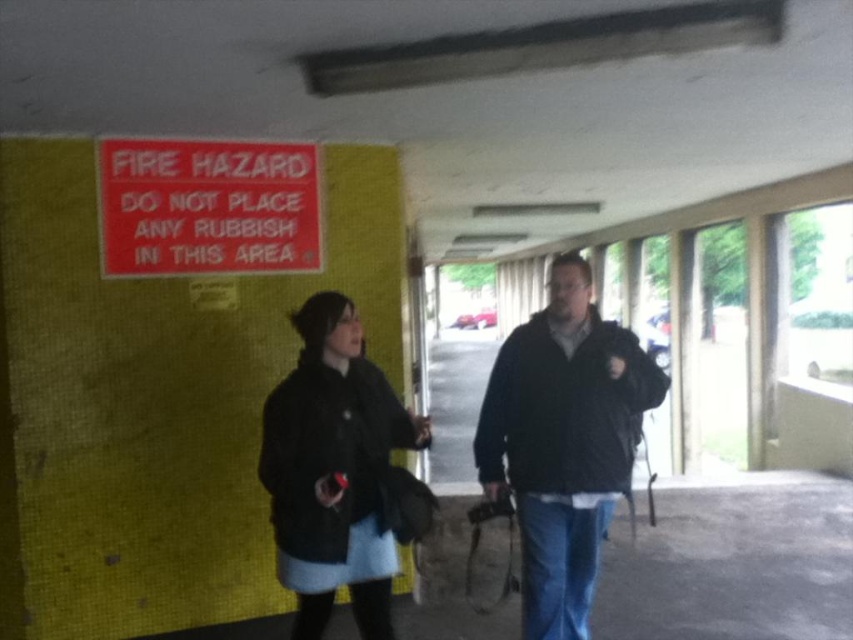
Who is taller, matte black jacket at center or black textured coat at center?

With more height is matte black jacket at center.

Between matte black jacket at center and black textured coat at center, which one is positioned higher?

Positioned higher is matte black jacket at center.

Which is in front, point (596, 346) or point (259, 472)?

Point (259, 472)

Identify the location of matte black jacket at center. (563, 442).

Does black textured coat at center have a greater width compared to red plastic sign at upper left?

No.

Is point (344, 470) less distant than point (306, 189)?

Yes, point (344, 470) is in front of point (306, 189).

You are a GUI agent. You are given a task and a screenshot of the screen. Output one action in this format:
    pyautogui.click(x=<x>, y=<y>)
    Task: Click on the black textured coat at center
    This screenshot has width=853, height=640.
    Given the screenshot: What is the action you would take?
    pyautogui.click(x=334, y=470)

Who is shorter, dark gray jacket at center or matte black jacket at center?

With less height is dark gray jacket at center.

Is dark gray jacket at center thinner than matte black jacket at center?

No.

The image size is (853, 640). Describe the element at coordinates (563, 442) in the screenshot. I see `dark gray jacket at center` at that location.

This screenshot has height=640, width=853. Find the location of `dark gray jacket at center`. dark gray jacket at center is located at coordinates (563, 442).